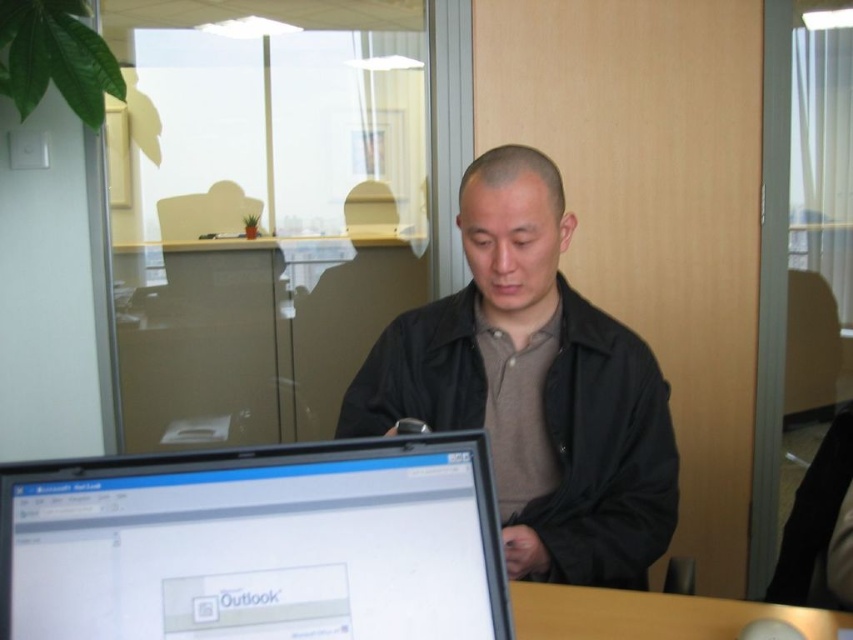
Question: Estimate the real-world distances between objects in this image. Which object is farther from the brown wooden table at lower center?

Choices:
 (A) black matte jacket at center
 (B) matte black laptop at lower left

Answer: (B)

Question: From the image, what is the correct spatial relationship of matte black laptop at lower left in relation to black matte jacket at center?

Choices:
 (A) below
 (B) above

Answer: (A)

Question: Is matte black laptop at lower left to the left of brown wooden table at lower center from the viewer's perspective?

Choices:
 (A) yes
 (B) no

Answer: (A)

Question: Which of the following is the farthest from the observer?

Choices:
 (A) brown wooden table at lower center
 (B) matte black laptop at lower left
 (C) black matte jacket at center

Answer: (C)

Question: Does matte black laptop at lower left have a greater width compared to black matte jacket at center?

Choices:
 (A) no
 (B) yes

Answer: (A)

Question: Which of these objects is positioned closest to the matte black laptop at lower left?

Choices:
 (A) brown wooden table at lower center
 (B) black matte jacket at center

Answer: (A)